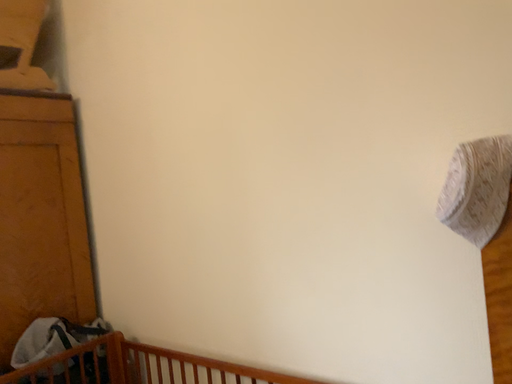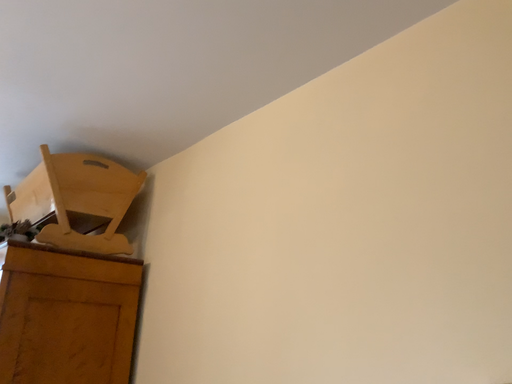
Question: How did the camera likely rotate when shooting the video?

Choices:
 (A) rotated upward
 (B) rotated downward

Answer: (A)